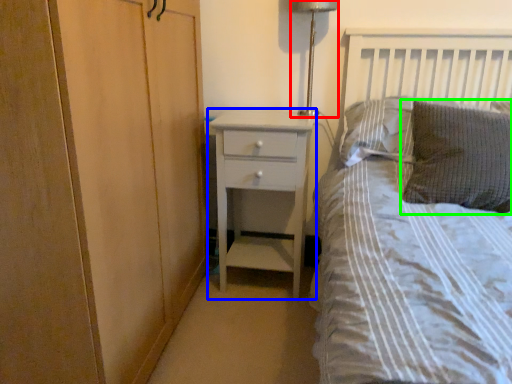
Question: Considering the real-world distances, which object is closest to bedside lamp (highlighted by a red box)? chest of drawers (highlighted by a blue box) or pillow (highlighted by a green box).

Choices:
 (A) chest of drawers
 (B) pillow

Answer: (A)